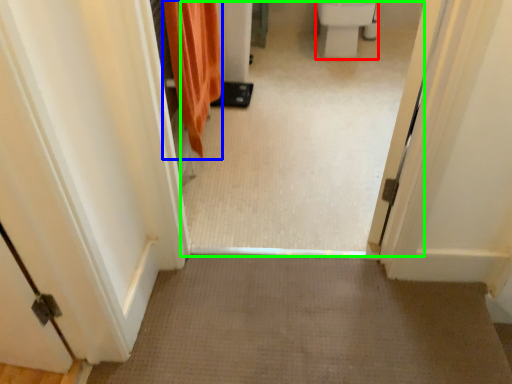
Question: Which is farther away from toilet bowl (highlighted by a red box)? shower curtain (highlighted by a blue box) or passage (highlighted by a green box)?

Choices:
 (A) shower curtain
 (B) passage

Answer: (A)